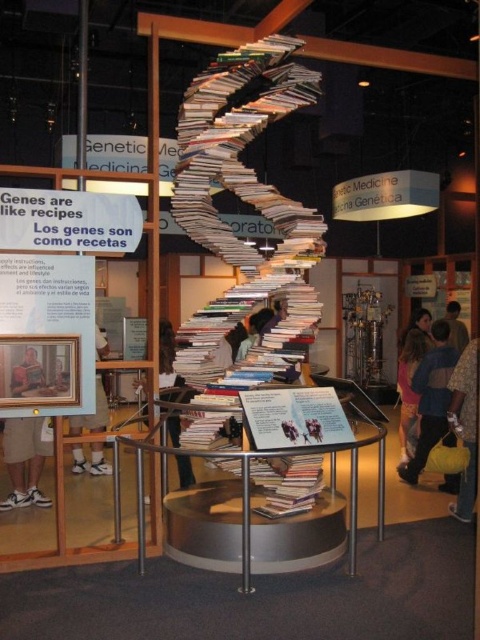
You are a museum visitor who wants to place a new item between the blue denim jacket at lower right and the tan shorts at lower left. Which side should you place it on to ensure it fits without overlapping either item?

The blue denim jacket at lower right is wider than the tan shorts at lower left. To place the new item between them without overlapping, position it closer to the tan shorts at lower left side since the jacket is wider and requires more space.

You are standing in front of the DNA helix book display. You see two points marked in the scene. The first point is at coordinates point (398, 428) and the second point is at point (459, 332). Which point is closer to you?

Point (398, 428) is in front of point (459, 332), so it is closer to you.